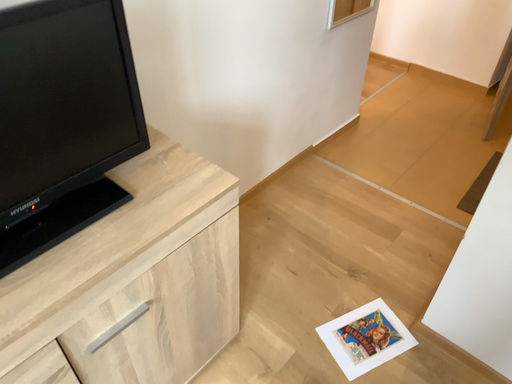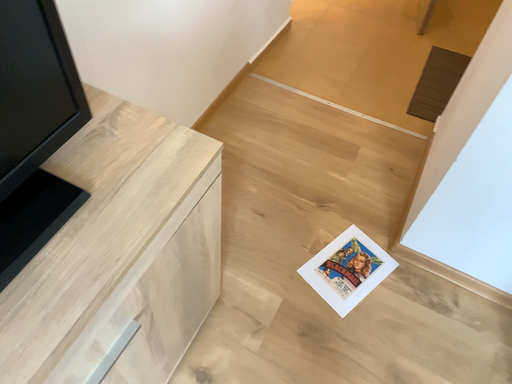
Question: How did the camera likely rotate when shooting the video?

Choices:
 (A) rotated downward
 (B) rotated upward

Answer: (A)